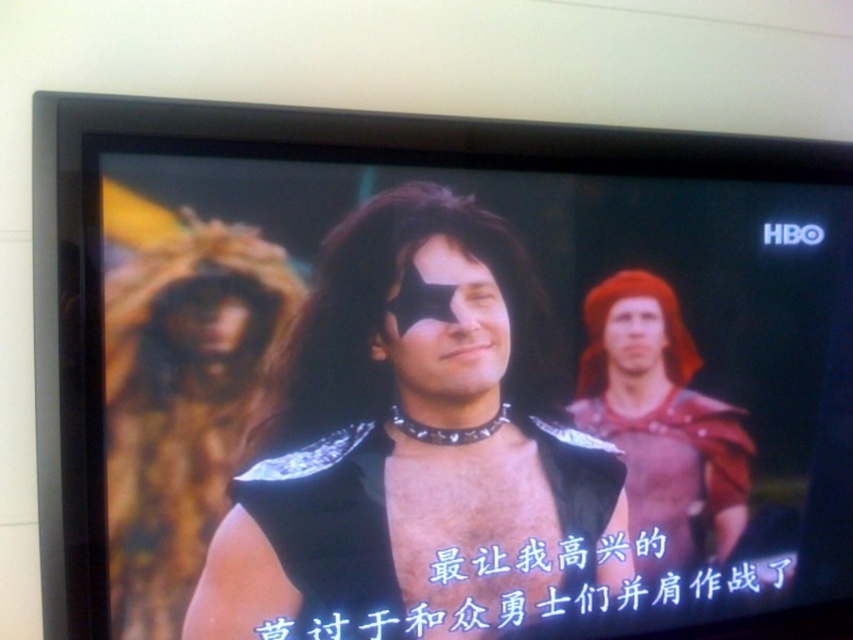
Question: From the image, what is the correct spatial relationship of shiny black armor at center in relation to red leather armor at right?

Choices:
 (A) below
 (B) above

Answer: (B)

Question: Which point is closer to the camera?

Choices:
 (A) (381, 291)
 (B) (621, 358)

Answer: (A)

Question: Is shiny black armor at center below red leather armor at right?

Choices:
 (A) yes
 (B) no

Answer: (B)

Question: Does shiny black armor at center have a smaller size compared to red leather armor at right?

Choices:
 (A) no
 (B) yes

Answer: (A)